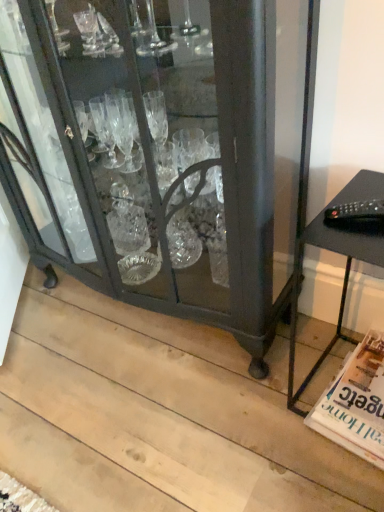
You are a GUI agent. You are given a task and a screenshot of the screen. Output one action in this format:
    pyautogui.click(x=<x>, y=<y>)
    Task: Click on the free region under matte black cabinet at center (from a real-world perspective)
    Image resolution: width=384 pixels, height=512 pixels.
    Given the screenshot: What is the action you would take?
    pyautogui.click(x=142, y=322)